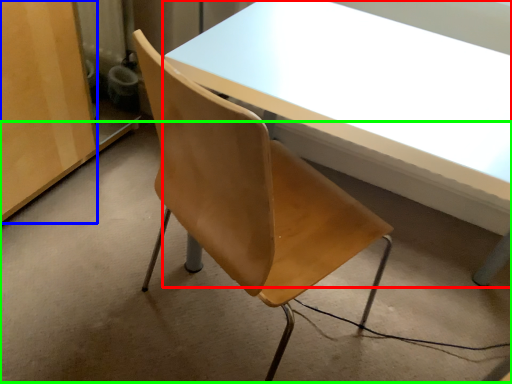
Question: Which object is positioned farthest from table (highlighted by a red box)? Select from plywood (highlighted by a blue box) and concrete (highlighted by a green box).

Choices:
 (A) plywood
 (B) concrete

Answer: (A)